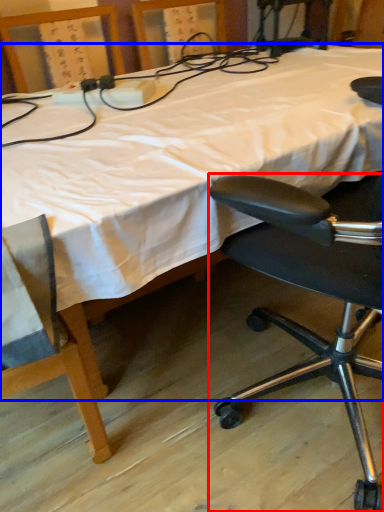
Question: Among these objects, which one is nearest to the camera, chair (highlighted by a red box) or bed (highlighted by a blue box)?

Choices:
 (A) chair
 (B) bed

Answer: (A)